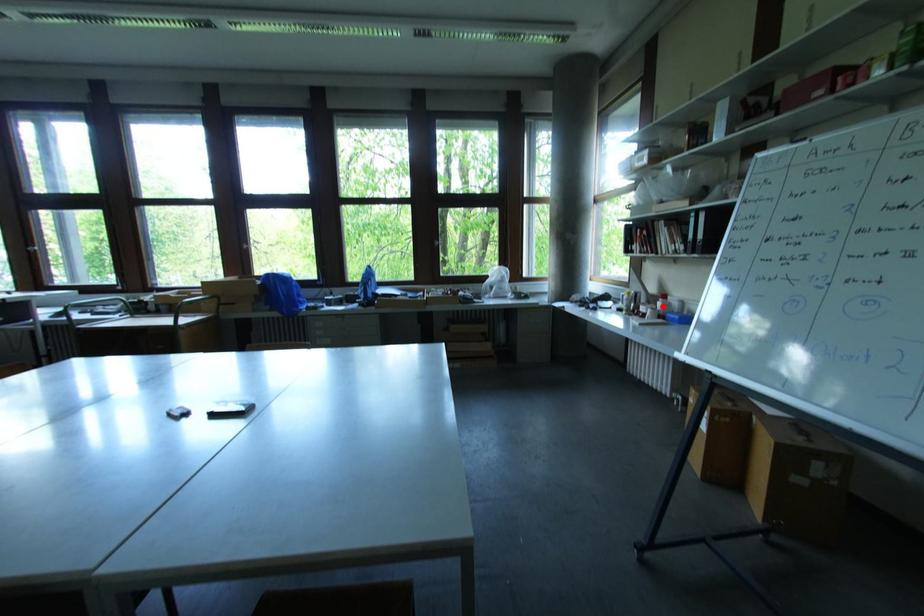
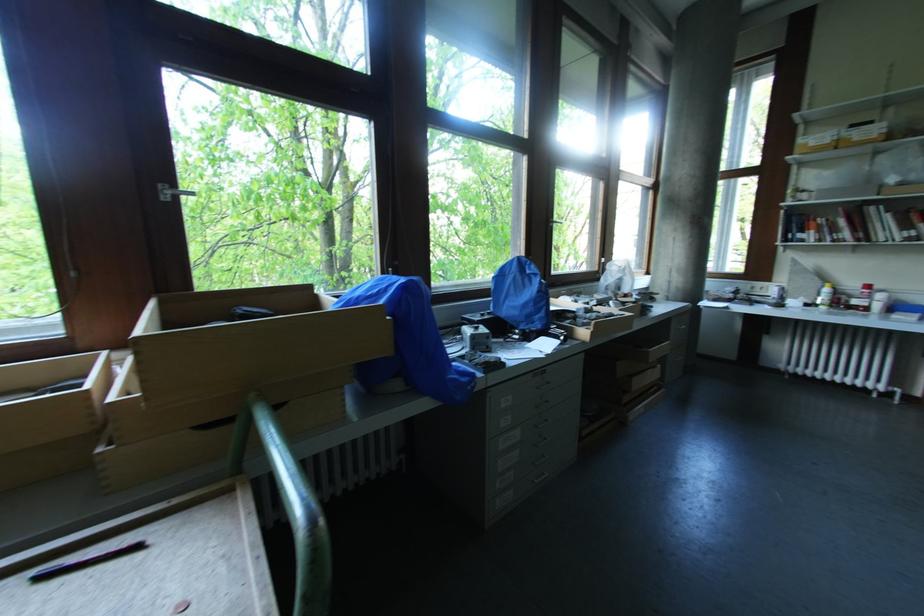
Find the pixel in the second image that matches the highlighted location in the first image.

(882, 298)